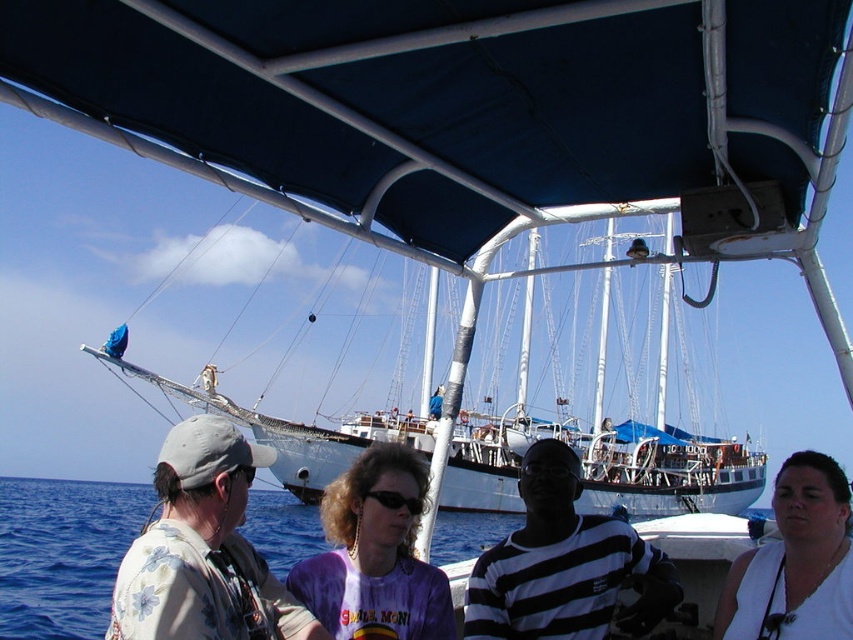
Between black striped shirt at center and purple tie-dye shirt at center, which one appears on the right side from the viewer's perspective?

From the viewer's perspective, black striped shirt at center appears more on the right side.

Which is in front, point (527, 598) or point (384, 621)?

Point (384, 621)

Where is `black striped shirt at center`? The width and height of the screenshot is (853, 640). black striped shirt at center is located at coordinates (564, 564).

Is point (486, 195) farther from viewer compared to point (503, 573)?

No, (486, 195) is in front of (503, 573).

Can you confirm if blue fabric canopy at upper center is taller than black striped shirt at center?

No, blue fabric canopy at upper center is not taller than black striped shirt at center.

At what (x,y) coordinates should I click in order to perform the action: click on blue fabric canopy at upper center. Please return your answer as a coordinate pair (x, y). Looking at the image, I should click on (445, 100).

Is white wooden sailboat at center further to the viewer compared to blue water at center?

No.

Based on the photo, is white wooden sailboat at center bigger than blue water at center?

Correct, white wooden sailboat at center is larger in size than blue water at center.

Find the location of a particular element. This screenshot has width=853, height=640. white wooden sailboat at center is located at coordinates (605, 460).